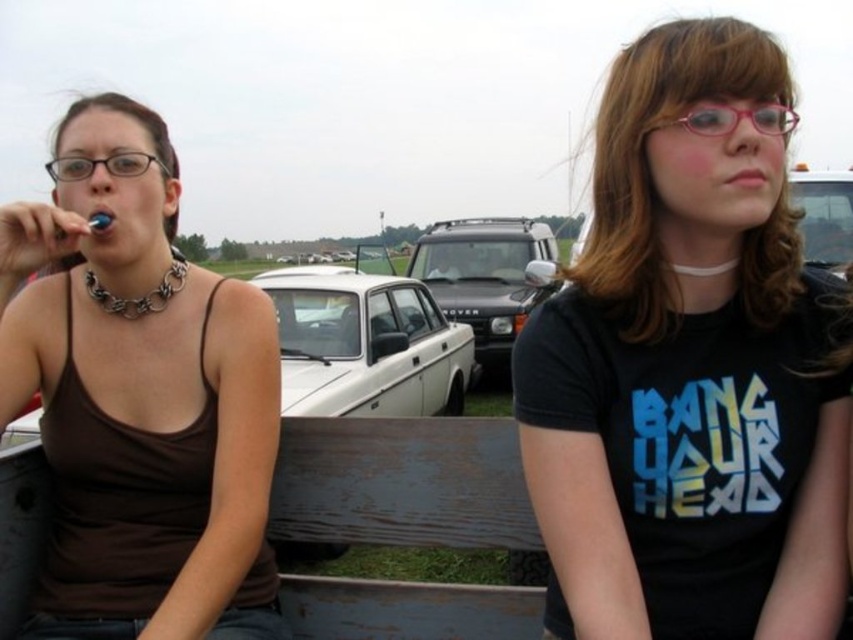
Question: Which object is the farthest from the white plastic toothbrush at left?

Choices:
 (A) white matte sedan at center
 (B) metallic silver car at center
 (C) matte black suv at center

Answer: (C)

Question: Which object is farther from the camera taking this photo?

Choices:
 (A) black matte t-shirt at center
 (B) silver metallic chain at left
 (C) white plastic toothbrush at left

Answer: (B)

Question: Can you confirm if black matte t-shirt at center is wider than white matte sedan at center?

Choices:
 (A) no
 (B) yes

Answer: (A)

Question: Is brown matte tank top at left further to camera compared to metallic silver car at center?

Choices:
 (A) no
 (B) yes

Answer: (A)

Question: Can you confirm if white matte sedan at center is smaller than metallic silver car at center?

Choices:
 (A) no
 (B) yes

Answer: (A)

Question: Which of the following is the farthest from the observer?

Choices:
 (A) (56, 228)
 (B) (827, 236)

Answer: (B)